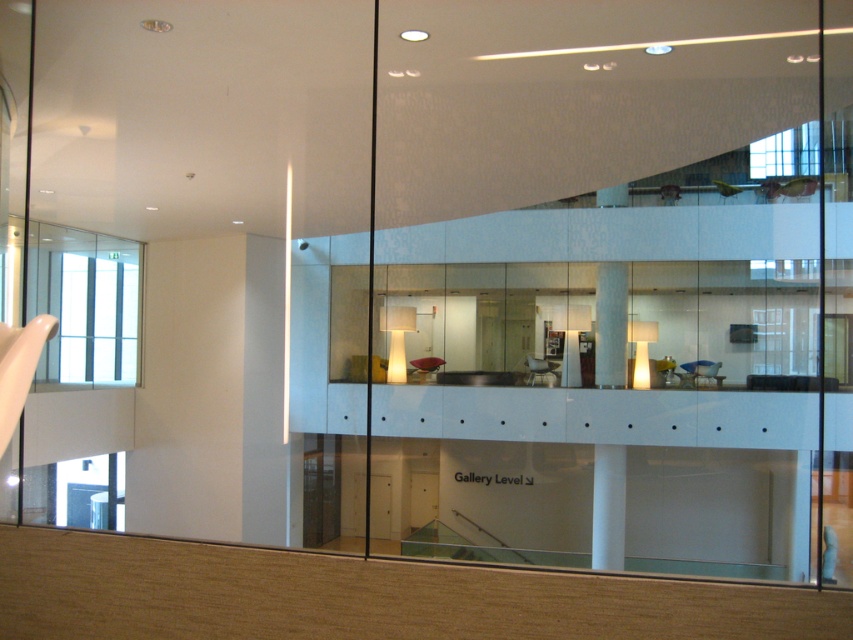
Is transparent glass at upper center to the right of white glossy pillar at center from the viewer's perspective?

Incorrect, transparent glass at upper center is not on the right side of white glossy pillar at center.

Is transparent glass at upper center to the left of white glossy pillar at center from the viewer's perspective?

Yes, transparent glass at upper center is to the left of white glossy pillar at center.

Is point (393, 368) farther from viewer compared to point (595, 525)?

No, (393, 368) is in front of (595, 525).

Locate an element on the screen. transparent glass at upper center is located at coordinates point(607,284).

Which is more to the left, transparent glass at upper center or white glossy balustrade at center?

transparent glass at upper center

Can you confirm if transparent glass at upper center is positioned to the left of white glossy balustrade at center?

Yes, transparent glass at upper center is to the left of white glossy balustrade at center.

The image size is (853, 640). Identify the location of transparent glass at upper center. (607, 284).

You are a GUI agent. You are given a task and a screenshot of the screen. Output one action in this format:
    pyautogui.click(x=<x>, y=<y>)
    Task: Click on the transparent glass at upper center
    
    Given the screenshot: What is the action you would take?
    pyautogui.click(x=607, y=284)

Who is higher up, white glossy balustrade at center or white glossy pillar at center?

white glossy balustrade at center is higher up.

Between white glossy balustrade at center and white glossy pillar at center, which one has more height?

With more height is white glossy pillar at center.

Is point (772, 397) closer to viewer compared to point (601, 556)?

Yes, point (772, 397) is closer to viewer.

Image resolution: width=853 pixels, height=640 pixels. Find the location of `white glossy balustrade at center`. white glossy balustrade at center is located at coordinates (598, 416).